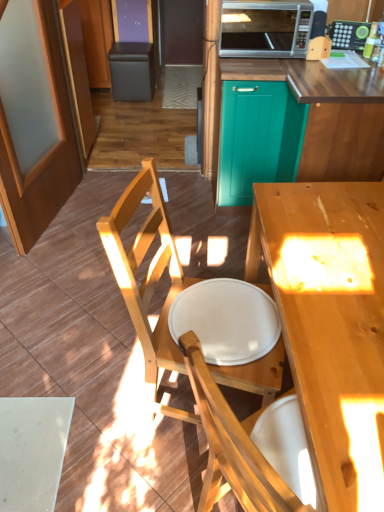
I want to click on free point above white matte plate at center (from a real-world perspective), so click(235, 312).